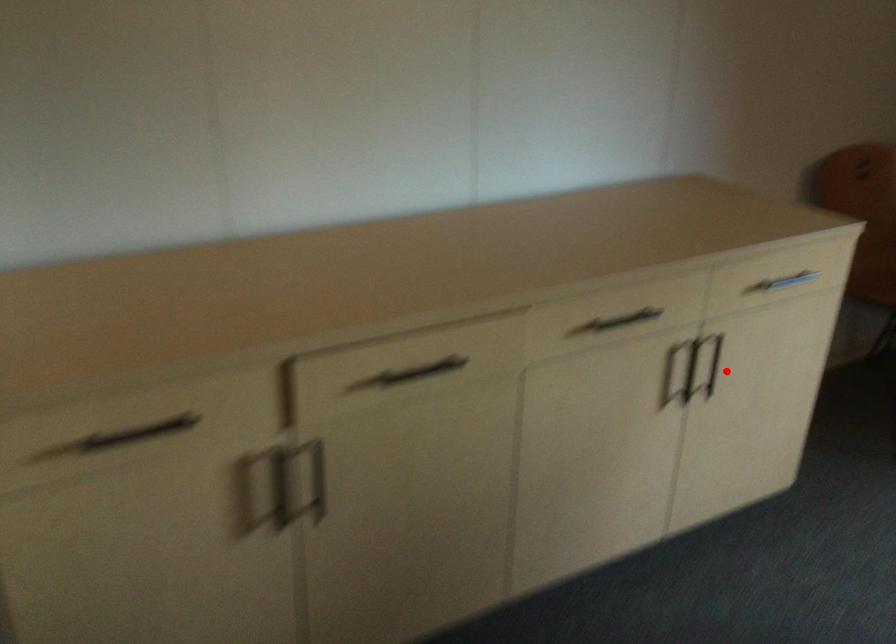
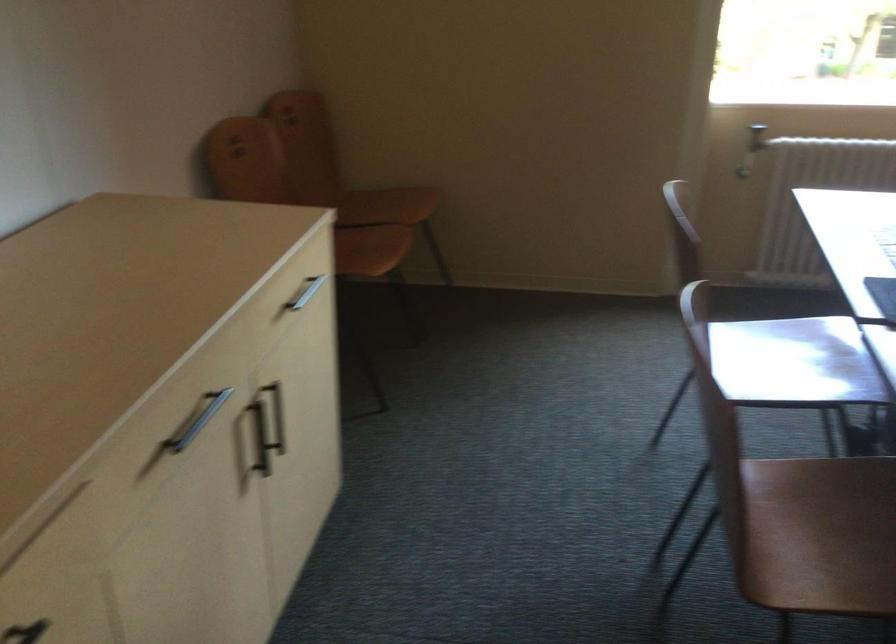
Question: I am providing you with two images of the same scene from different viewpoints. Image1 has a red point marked. In image2, the corresponding 3D location appears at what relative position? Reply with the corresponding letter.

Choices:
 (A) Closer
 (B) Farther

Answer: (A)